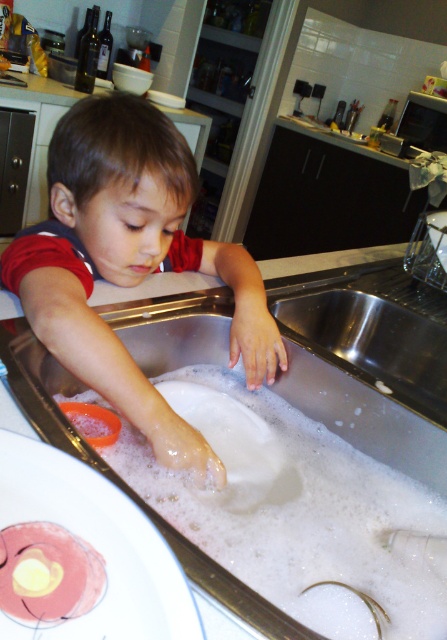
Looking at this image, based on the scene description, what are the coordinates of the stainless steel sink at lower center in the image?

The stainless steel sink at lower center is located at coordinates (369, 360).

The child wants to wash their hand thoroughly. Given the size of the stainless steel sink at lower center and the white matte hand at lower center, will the sink be wide enough to accommodate the hand comfortably?

The stainless steel sink at lower center is wider than the white matte hand at lower center, so the sink will comfortably accommodate the hand.

You are a photographer taking a picture of the kitchen scene. You notice two points in the image at coordinates point (x=253, y=356) and point (x=216, y=467). Which point should you focus on to ensure the foreground element is sharp?

You should focus on point (x=253, y=356) because it is closer to the camera than point (x=216, y=467), making it the foreground element.